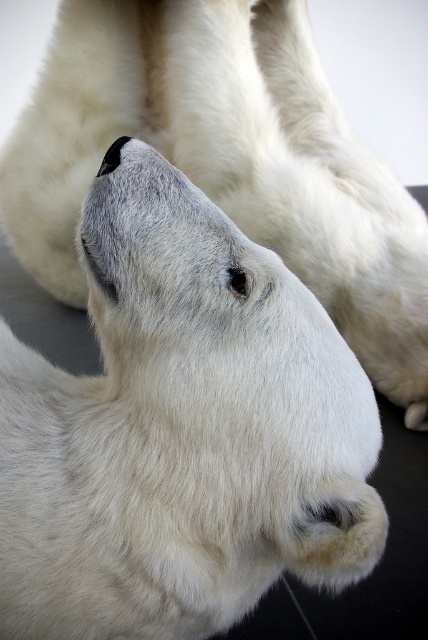
Who is lower down, white fur polar bear at center or white fur at center?

white fur polar bear at center is lower down.

Between point (181, 248) and point (279, 97), which one is positioned behind?

Point (279, 97)

At what (x,y) coordinates should I click in order to perform the action: click on white fur polar bear at center. Please return your answer as a coordinate pair (x, y). This screenshot has height=640, width=428. Looking at the image, I should click on (181, 429).